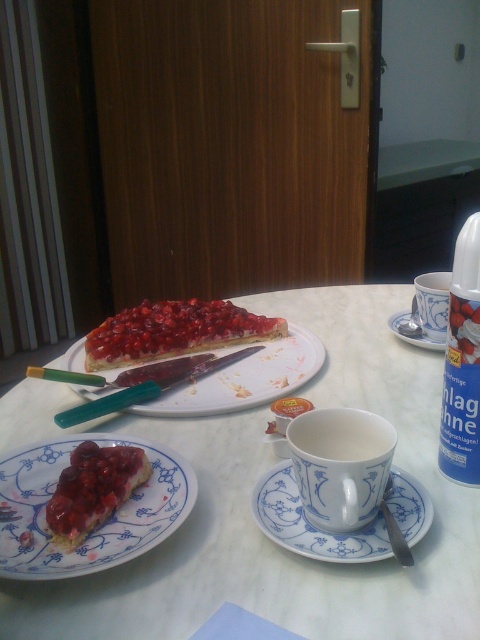
Who is more forward, (295, 600) or (342, 522)?

Point (295, 600) is more forward.

Does white glossy table at center have a larger size compared to white ceramic mug at center?

Yes.

Identify the location of white glossy table at center. The image size is (480, 640). (250, 509).

Between white ceramic plate at center and white porcelain saucer at center, which one has more height?

With more height is white ceramic plate at center.

This screenshot has width=480, height=640. What do you see at coordinates (247, 380) in the screenshot?
I see `white ceramic plate at center` at bounding box center [247, 380].

You are a GUI agent. You are given a task and a screenshot of the screen. Output one action in this format:
    pyautogui.click(x=<x>, y=<y>)
    Task: Click on the white ceramic plate at center
    
    Given the screenshot: What is the action you would take?
    pyautogui.click(x=247, y=380)

Does white ceramic mug at center appear over white ceramic mug at upper center?

Actually, white ceramic mug at center is below white ceramic mug at upper center.

Does white ceramic mug at center appear under white ceramic mug at upper center?

Correct, white ceramic mug at center is located below white ceramic mug at upper center.

The width and height of the screenshot is (480, 640). What are the coordinates of `white ceramic mug at center` in the screenshot? It's located at (340, 465).

Image resolution: width=480 pixels, height=640 pixels. I want to click on white ceramic mug at center, so click(x=340, y=465).